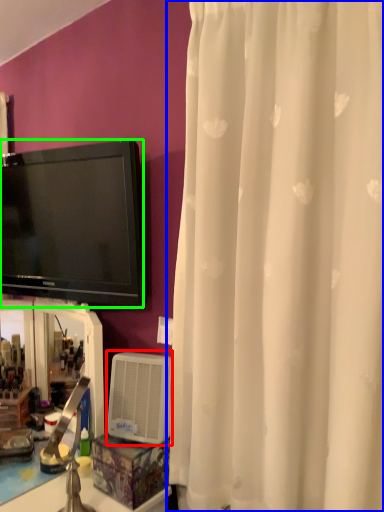
Question: Which object is the closest to the air conditioner (highlighted by a red box)? Choose among these: curtain (highlighted by a blue box) or television (highlighted by a green box).

Choices:
 (A) curtain
 (B) television

Answer: (A)